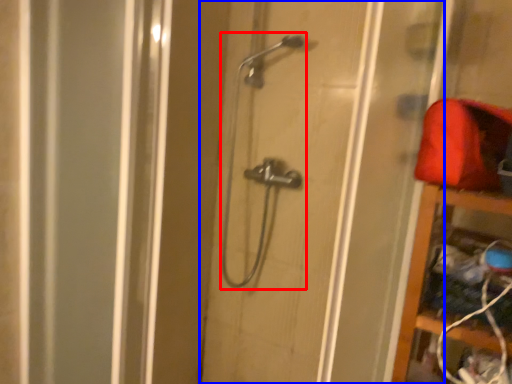
Question: Which object appears closest to the camera in this image, shower (highlighted by a red box) or door (highlighted by a blue box)?

Choices:
 (A) shower
 (B) door

Answer: (B)